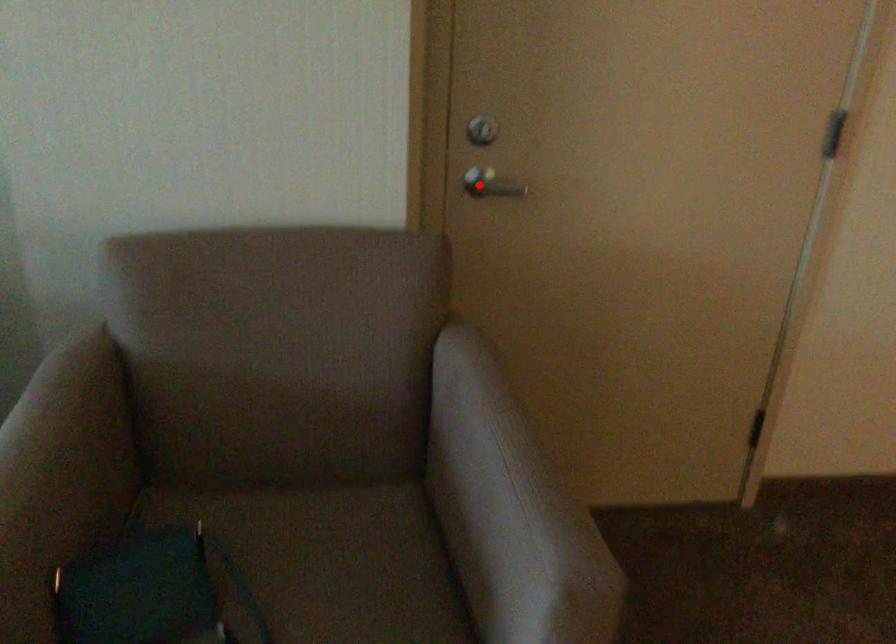
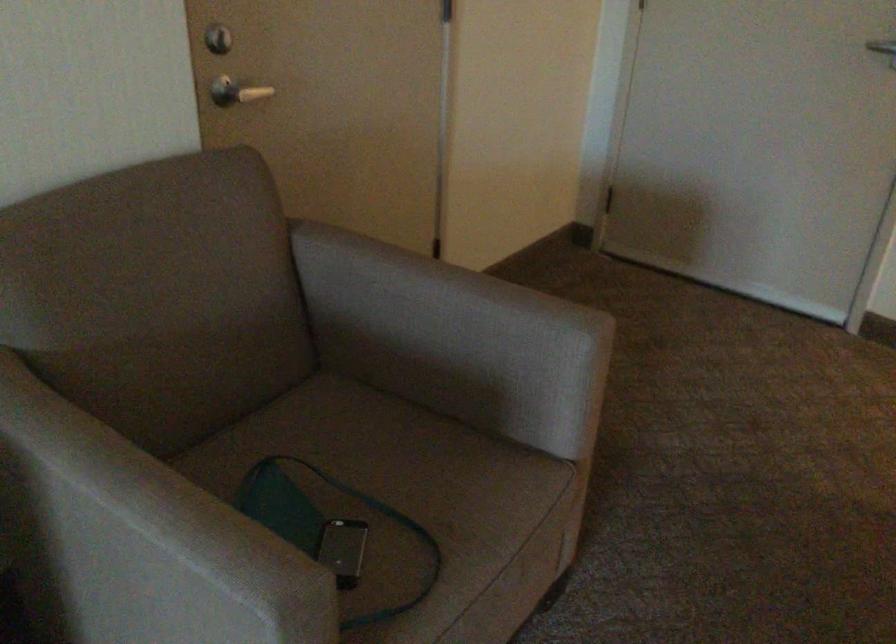
Where in the second image is the point corresponding to the highlighted location from the first image?

(236, 91)